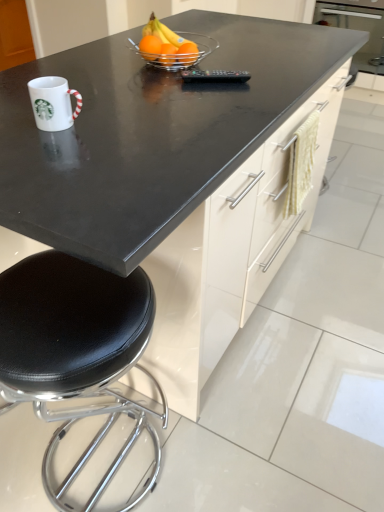
Locate an element on the screen. This screenshot has width=384, height=512. free space between white glossy mug at left and orange matte at center, acting as the third orange starting from the right is located at coordinates (111, 93).